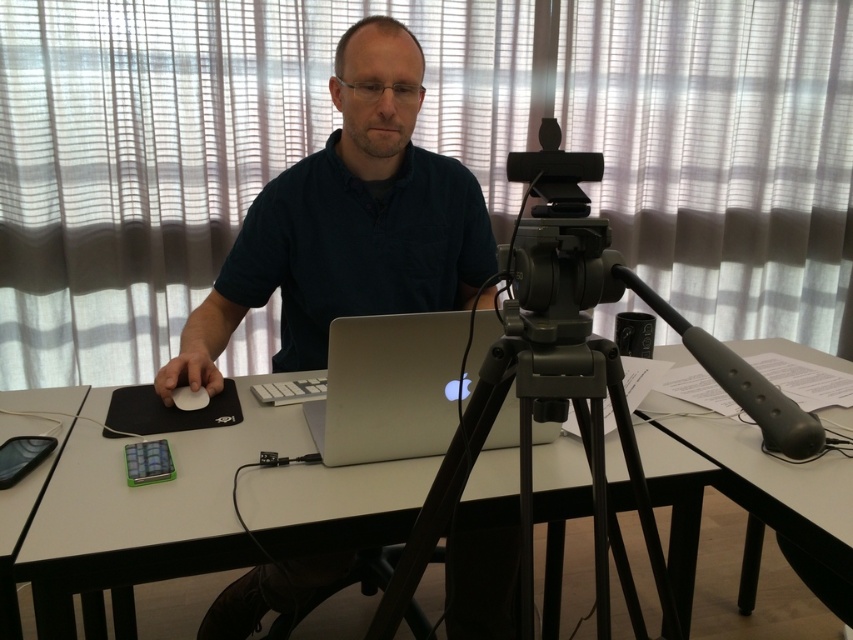
Is point (312, 221) less distant than point (428, 388)?

No, it is not.

How distant is dark blue shirt at center from silver metallic laptop at center?

dark blue shirt at center is 15.91 inches away from silver metallic laptop at center.

Between point (384, 147) and point (337, 444), which one is positioned in front?

Point (337, 444)

This screenshot has width=853, height=640. I want to click on dark blue shirt at center, so pos(349,221).

Who is more distant from viewer, (x=520, y=448) or (x=395, y=356)?

Point (x=395, y=356)

Between point (677, 616) and point (450, 429), which one is positioned in front?

Point (677, 616)

This screenshot has height=640, width=853. In order to click on matte black tripod at center in this screenshot , I will do click(x=531, y=474).

Which of these two, white glossy table at center or white matte mouse at left, stands shorter?

white matte mouse at left

I want to click on white glossy table at center, so click(142, 513).